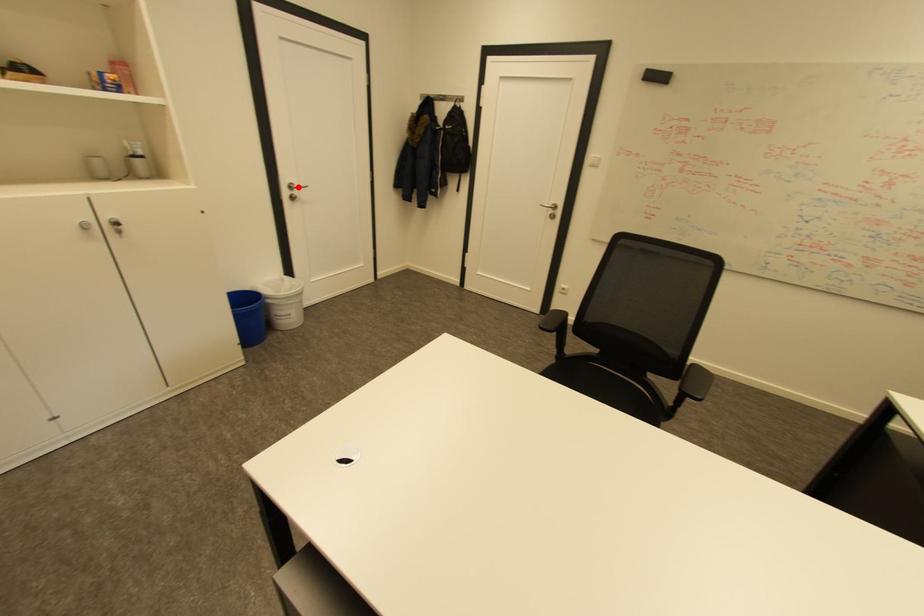
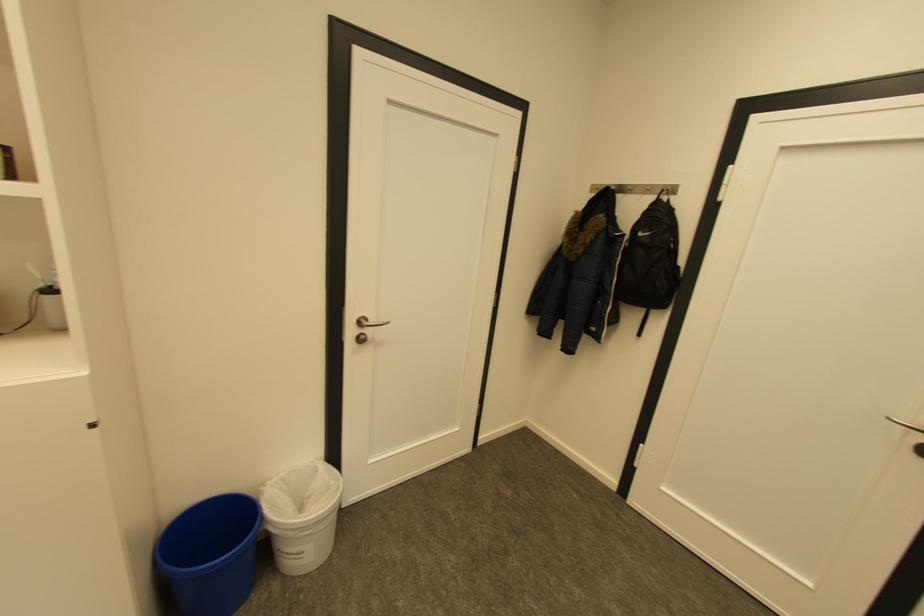
Where in the second image is the point corresponding to the highlighted location from the first image?

(367, 323)